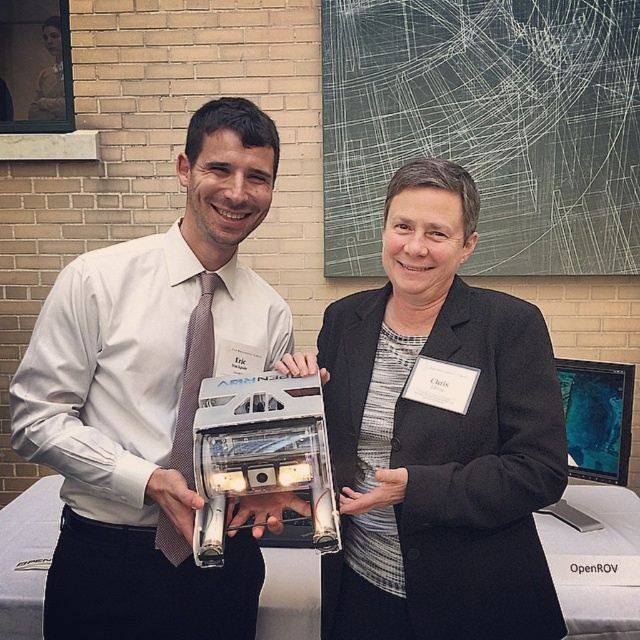
Question: Is matte white shirt at center smaller than matte black jacket at center?

Choices:
 (A) no
 (B) yes

Answer: (A)

Question: Can you confirm if matte white shirt at center is positioned to the right of matte black jacket at center?

Choices:
 (A) yes
 (B) no

Answer: (B)

Question: Which object appears closest to the camera in this image?

Choices:
 (A) matte white shirt at center
 (B) matte black jacket at center

Answer: (A)

Question: Which of the following is the closest to the observer?

Choices:
 (A) (244, 538)
 (B) (385, 264)

Answer: (B)

Question: Which point is closer to the camera?

Choices:
 (A) (467, 544)
 (B) (150, 337)

Answer: (A)

Question: Is matte white shirt at center wider than matte black jacket at center?

Choices:
 (A) yes
 (B) no

Answer: (A)